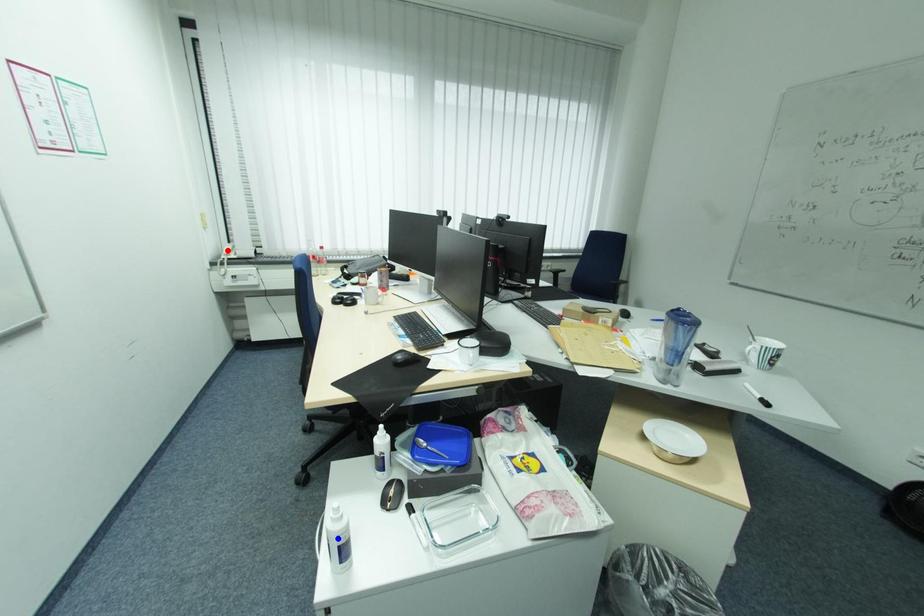
Question: In the image, two points are highlighted. Which point is nearer to the camera? Reply with the corresponding letter.

Choices:
 (A) blue point
 (B) red point

Answer: (A)